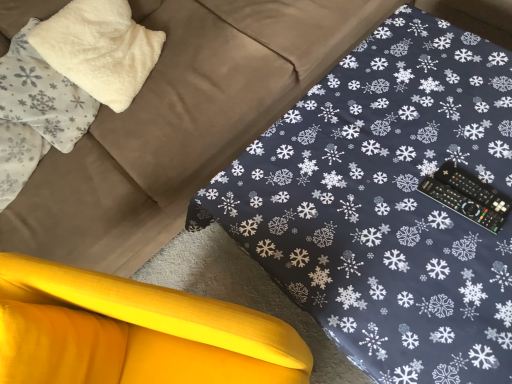
Question: In the image, is yellow fabric cushion at lower left positioned in front of or behind white fluffy pillow at upper left, the first pillow when ordered from right to left?

Choices:
 (A) front
 (B) behind

Answer: (A)

Question: Is yellow fabric cushion at lower left taller or shorter than white fluffy pillow at upper left, which ranks as the 2th pillow in left-to-right order?

Choices:
 (A) short
 (B) tall

Answer: (B)

Question: Estimate the real-world distances between objects in this image. Which object is closer to the yellow fabric cushion at lower left?

Choices:
 (A) black plastic remote at right
 (B) white fluffy pillow at upper left, which is the 2th pillow in right-to-left order
 (C) white fluffy pillow at upper left, which ranks as the 2th pillow in left-to-right order

Answer: (A)

Question: Estimate the real-world distances between objects in this image. Which object is farther from the yellow fabric cushion at lower left?

Choices:
 (A) white fluffy pillow at upper left, which is counted as the 1th pillow, starting from the left
 (B) black plastic remote at right
 (C) white fluffy pillow at upper left, which ranks as the 2th pillow in left-to-right order

Answer: (C)